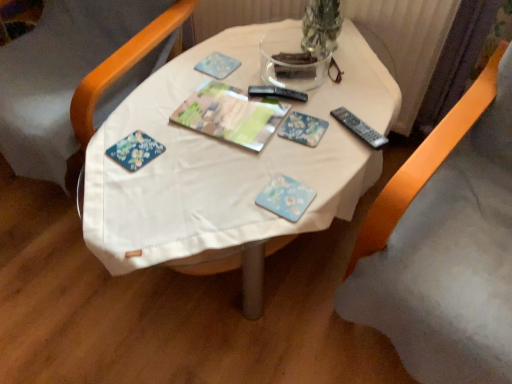
In order to click on white fabric table at center in this screenshot , I will do `click(228, 169)`.

The height and width of the screenshot is (384, 512). I want to click on floral-patterned paper at center-left, so click(135, 151).

The image size is (512, 384). What do you see at coordinates (135, 151) in the screenshot? I see `floral-patterned paper at center-left` at bounding box center [135, 151].

What do you see at coordinates (285, 197) in the screenshot?
I see `blue floral coaster at center, which is the second paperback book from top to bottom` at bounding box center [285, 197].

You are a GUI agent. You are given a task and a screenshot of the screen. Output one action in this format:
    pyautogui.click(x=<x>, y=<y>)
    Task: Click on the floral-patterned paper at center, positioned as the first paperback book in back-to-front order
    Image resolution: width=512 pixels, height=384 pixels.
    Given the screenshot: What is the action you would take?
    pyautogui.click(x=303, y=129)

Locate an element on the screen. The image size is (512, 384). orange fabric chair at lower right, marked as the 1th chair in a right-to-left arrangement is located at coordinates (445, 245).

You are a GUI agent. You are given a task and a screenshot of the screen. Output one action in this format:
    pyautogui.click(x=<x>, y=<y>)
    Task: Click on the floral paper magazine at center
    Image resolution: width=512 pixels, height=384 pixels.
    Given the screenshot: What is the action you would take?
    pyautogui.click(x=230, y=115)

Image resolution: width=512 pixels, height=384 pixels. I want to click on white fabric table at center, so click(228, 169).

Is wooden chair at left, which is the second chair from right to left, closer to camera compared to blue floral coaster at center, the 1th paperback book from the front?

Yes.

From the image's perspective, between wooden chair at left, which is the second chair from right to left, and blue floral coaster at center, arranged as the first paperback book when ordered from the bottom, which one is located above?

wooden chair at left, which is the second chair from right to left, from the image's perspective.

Based on the photo, who is shorter, wooden chair at left, which is the second chair from right to left, or blue floral coaster at center, arranged as the first paperback book when ordered from the bottom?

Standing shorter between the two is blue floral coaster at center, arranged as the first paperback book when ordered from the bottom.

Is blue floral coaster at center, which is the second paperback book from top to bottom, inside wooden chair at left, which is the second chair from right to left?

That's incorrect, blue floral coaster at center, which is the second paperback book from top to bottom, is not inside wooden chair at left, which is the second chair from right to left.

From the image's perspective, does blue floral coaster at center, which is the second paperback book from top to bottom, appear lower than white fabric table at center?

Yes, from the image's perspective, blue floral coaster at center, which is the second paperback book from top to bottom, is below white fabric table at center.

Could you tell me if blue floral coaster at center, the 2th paperback book viewed from the back, is turned towards white fabric table at center?

Yes.

Is blue floral coaster at center, the 1th paperback book from the front, touching white fabric table at center?

No, blue floral coaster at center, the 1th paperback book from the front, is not making contact with white fabric table at center.

Is blue floral coaster at center, the 1th paperback book from the front, positioned before white fabric table at center?

No, blue floral coaster at center, the 1th paperback book from the front, is behind white fabric table at center.

From a real-world perspective, is black plastic remote at right positioned above or below floral-patterned paper at center, placed as the 2th paperback book when sorted from bottom to top?

From a real-world perspective, black plastic remote at right is physically above floral-patterned paper at center, placed as the 2th paperback book when sorted from bottom to top.

Is black plastic remote at right surrounding floral-patterned paper at center, the second paperback book when ordered from front to back?

Definitely not — floral-patterned paper at center, the second paperback book when ordered from front to back, is not inside black plastic remote at right.

Could you tell me if black plastic remote at right is turned towards floral-patterned paper at center, positioned as the first paperback book in back-to-front order?

Yes, black plastic remote at right faces towards floral-patterned paper at center, positioned as the first paperback book in back-to-front order.

Is floral paper magazine at center aimed at floral-patterned paper at center-left?

Yes, floral paper magazine at center faces towards floral-patterned paper at center-left.

From the image's perspective, would you say floral paper magazine at center is shown under floral-patterned paper at center-left?

No, from the image's perspective, floral paper magazine at center is not below floral-patterned paper at center-left.

From a real-world perspective, which object rests below the other?

floral-patterned paper at center-left is physically lower.

Consider the image. Are floral paper magazine at center and floral-patterned paper at center-left located far from each other?

No, floral paper magazine at center is not far away from floral-patterned paper at center-left.

How different are the orientations of black plastic remote at right and floral paper magazine at center in degrees?

The angle between the facing direction of black plastic remote at right and the facing direction of floral paper magazine at center is 30.8 degrees.

Can you confirm if black plastic remote at right is shorter than floral paper magazine at center?

Indeed, black plastic remote at right has a lesser height compared to floral paper magazine at center.

From a real-world perspective, who is located higher, black plastic remote at right or floral paper magazine at center?

black plastic remote at right is physically above.

Between black plastic remote at right and floral paper magazine at center, which one appears on the left side from the viewer's perspective?

floral paper magazine at center is more to the left.

Looking at their sizes, would you say wooden chair at left, which is the second chair from right to left, is wider or thinner than black plastic remote at right?

Clearly, wooden chair at left, which is the second chair from right to left, has more width compared to black plastic remote at right.

Considering the relative positions of wooden chair at left, the 1th chair in the left-to-right sequence, and black plastic remote at right in the image provided, is wooden chair at left, the 1th chair in the left-to-right sequence, to the left of black plastic remote at right from the viewer's perspective?

Yes.

Which is closer to the camera, (4, 66) or (345, 126)?

Point (4, 66) appears to be farther away from the viewer than point (345, 126).

Are wooden chair at left, which is the second chair from right to left, and black plastic remote at right beside each other?

No, wooden chair at left, which is the second chair from right to left, is not with black plastic remote at right.

Consider the image. Considering the sizes of orange fabric chair at lower right, the second chair when ordered from left to right, and white fabric table at center in the image, is orange fabric chair at lower right, the second chair when ordered from left to right, wider or thinner than white fabric table at center?

Considering their sizes, orange fabric chair at lower right, the second chair when ordered from left to right, looks slimmer than white fabric table at center.

Is orange fabric chair at lower right, marked as the 1th chair in a right-to-left arrangement, taller than white fabric table at center?

Indeed, orange fabric chair at lower right, marked as the 1th chair in a right-to-left arrangement, has a greater height compared to white fabric table at center.

Is the position of orange fabric chair at lower right, marked as the 1th chair in a right-to-left arrangement, more distant than that of white fabric table at center?

No.

Could white fabric table at center be considered to be inside orange fabric chair at lower right, the second chair when ordered from left to right?

No, white fabric table at center is not inside orange fabric chair at lower right, the second chair when ordered from left to right.

From a real-world perspective, which paperback book is the 1st one above the wooden chair at left, which is the second chair from right to left? Please provide its 2D coordinates.

[(285, 197)]

The height and width of the screenshot is (384, 512). In the image, there is a white fabric table at center. What are the coordinates of `paperback book below it (from the image's perspective)` in the screenshot? It's located at (285, 197).

Considering their positions, is floral-patterned paper at center, placed as the 2th paperback book when sorted from bottom to top, positioned further to floral paper magazine at center than blue floral coaster at center, which is the second paperback book from top to bottom?

blue floral coaster at center, which is the second paperback book from top to bottom, lies further to floral paper magazine at center than the other object.

Estimate the real-world distances between objects in this image. Which object is further from floral-patterned paper at center-left, wooden chair at left, the 1th chair in the left-to-right sequence, or white fabric table at center?

wooden chair at left, the 1th chair in the left-to-right sequence, is positioned further to the anchor floral-patterned paper at center-left.

Based on their spatial positions, is white fabric table at center or orange fabric chair at lower right, marked as the 1th chair in a right-to-left arrangement, closer to floral-patterned paper at center, acting as the first paperback book starting from the top?

white fabric table at center.

From the image, which object appears to be nearer to orange fabric chair at lower right, marked as the 1th chair in a right-to-left arrangement, blue floral coaster at center, the 1th paperback book from the front, or white fabric table at center?

white fabric table at center.

Consider the image. Estimate the real-world distances between objects in this image. Which object is further from blue floral coaster at center, which is the second paperback book from top to bottom, floral-patterned paper at center, positioned as the first paperback book in back-to-front order, or black plastic remote at right?

Among the two, black plastic remote at right is located further to blue floral coaster at center, which is the second paperback book from top to bottom.

From the picture: Based on their spatial positions, is floral-patterned paper at center, acting as the first paperback book starting from the top, or blue floral coaster at center, the 1th paperback book from the front, further from white fabric table at center?

blue floral coaster at center, the 1th paperback book from the front.

From the image, which object appears to be nearer to black plastic remote at right, blue floral coaster at center, which is the second paperback book from top to bottom, or white fabric table at center?

Based on the image, blue floral coaster at center, which is the second paperback book from top to bottom, appears to be nearer to black plastic remote at right.

Considering their positions, is floral-patterned paper at center, acting as the first paperback book starting from the top, positioned further to orange fabric chair at lower right, marked as the 1th chair in a right-to-left arrangement, than black plastic remote at right?

floral-patterned paper at center, acting as the first paperback book starting from the top, is further to orange fabric chair at lower right, marked as the 1th chair in a right-to-left arrangement.

Find the location of a particular element. Image resolution: width=512 pixels, height=384 pixels. magazine between floral-patterned paper at center-left and floral-patterned paper at center, acting as the first paperback book starting from the top, in the horizontal direction is located at coordinates (230, 115).

Find the location of `table located between wooden chair at left, which is the second chair from right to left, and black plastic remote at right in the left-right direction`. table located between wooden chair at left, which is the second chair from right to left, and black plastic remote at right in the left-right direction is located at coordinates (228, 169).

This screenshot has width=512, height=384. I want to click on table between floral-patterned paper at center-left and orange fabric chair at lower right, marked as the 1th chair in a right-to-left arrangement, from left to right, so click(x=228, y=169).

Where is `remote between orange fabric chair at lower right, the second chair when ordered from left to right, and floral-patterned paper at center, acting as the first paperback book starting from the top, along the z-axis`? remote between orange fabric chair at lower right, the second chair when ordered from left to right, and floral-patterned paper at center, acting as the first paperback book starting from the top, along the z-axis is located at coordinates (359, 128).